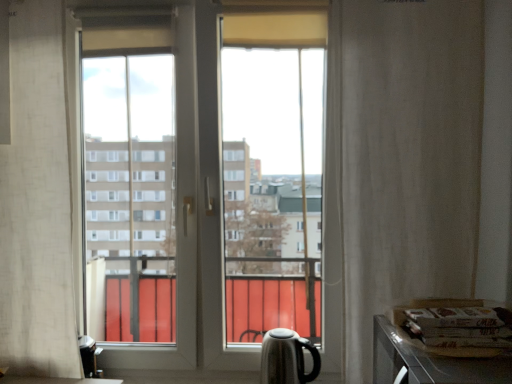
Question: From a real-world perspective, is white textured curtain at right, the 2th curtain positioned from the left, located higher than black glossy kettle at lower right?

Choices:
 (A) no
 (B) yes

Answer: (B)

Question: Does white textured curtain at right, which is the first curtain from right to left, have a lesser width compared to black glossy kettle at lower right?

Choices:
 (A) yes
 (B) no

Answer: (A)

Question: Is white textured curtain at right, the 2th curtain positioned from the left, wider than black glossy kettle at lower right?

Choices:
 (A) no
 (B) yes

Answer: (A)

Question: From the image's perspective, is white textured curtain at right, the 2th curtain positioned from the left, below black glossy kettle at lower right?

Choices:
 (A) no
 (B) yes

Answer: (A)

Question: Can you confirm if white textured curtain at right, the 2th curtain positioned from the left, is taller than black glossy kettle at lower right?

Choices:
 (A) yes
 (B) no

Answer: (A)

Question: In terms of width, does metallic silver counter top at lower right look wider or thinner when compared to transparent glass window at center?

Choices:
 (A) thin
 (B) wide

Answer: (B)

Question: From a real-world perspective, is metallic silver counter top at lower right above or below transparent glass window at center?

Choices:
 (A) below
 (B) above

Answer: (A)

Question: In terms of size, does metallic silver counter top at lower right appear bigger or smaller than transparent glass window at center?

Choices:
 (A) big
 (B) small

Answer: (B)

Question: Considering their positions, is metallic silver counter top at lower right located in front of or behind transparent glass window at center?

Choices:
 (A) behind
 (B) front

Answer: (B)

Question: In terms of height, does white sheer curtain at left, which is the 2th curtain from right to left, look taller or shorter compared to transparent glass window at center?

Choices:
 (A) short
 (B) tall

Answer: (A)

Question: Is white sheer curtain at left, which is the 2th curtain from right to left, situated inside transparent glass window at center or outside?

Choices:
 (A) outside
 (B) inside

Answer: (A)

Question: Does point (8, 322) appear closer or farther from the camera than point (118, 107)?

Choices:
 (A) closer
 (B) farther

Answer: (A)

Question: In the image, is white sheer curtain at left, which is the 2th curtain from right to left, on the left side or the right side of transparent glass window at center?

Choices:
 (A) right
 (B) left

Answer: (B)

Question: Does point (98, 241) appear closer or farther from the camera than point (417, 235)?

Choices:
 (A) farther
 (B) closer

Answer: (A)

Question: Considering the positions of transparent glass window at center and white textured curtain at right, which is the first curtain from right to left, in the image, is transparent glass window at center taller or shorter than white textured curtain at right, which is the first curtain from right to left,?

Choices:
 (A) tall
 (B) short

Answer: (A)